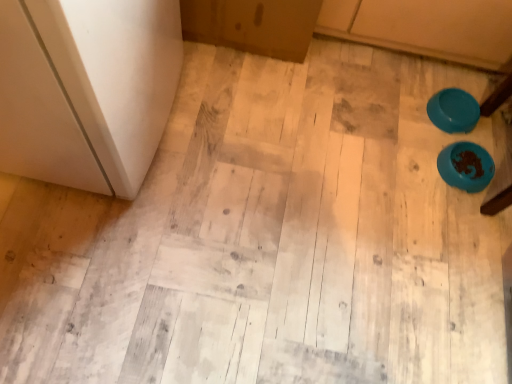
Locate an element on the screen. This screenshot has height=384, width=512. empty space that is to the right of teal glossy bowl at upper right, which is the first bowl from top to bottom is located at coordinates (490, 127).